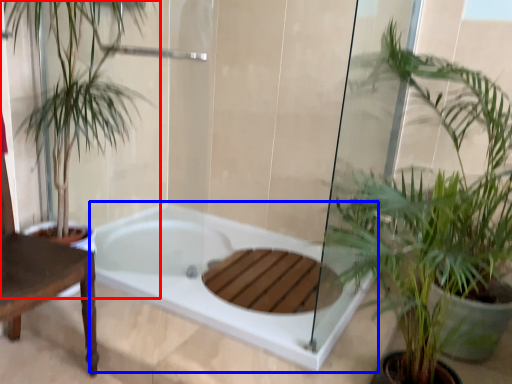
Question: Which object appears farthest to the camera in this image, houseplant (highlighted by a red box) or bathtub (highlighted by a blue box)?

Choices:
 (A) houseplant
 (B) bathtub

Answer: (B)